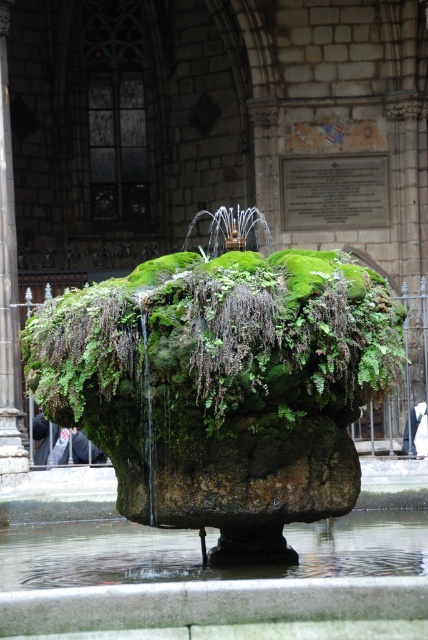
Question: Does green mossy rock at center have a larger size compared to clear water at base center?

Choices:
 (A) no
 (B) yes

Answer: (B)

Question: Which point is closer to the camera?

Choices:
 (A) green mossy rock at center
 (B) clear water at base center
 (C) dark gray stone pillar at center

Answer: (A)

Question: Which object appears closest to the camera in this image?

Choices:
 (A) clear water at base center
 (B) green mossy rock at center
 (C) dark gray stone pillar at center

Answer: (B)

Question: Is green mossy rock at center smaller than clear water at base center?

Choices:
 (A) yes
 (B) no

Answer: (B)

Question: Which of these objects is positioned closest to the clear water at base center?

Choices:
 (A) dark gray stone pillar at center
 (B) green mossy rock at center

Answer: (B)

Question: Is green mossy rock at center wider than clear water at base center?

Choices:
 (A) yes
 (B) no

Answer: (B)